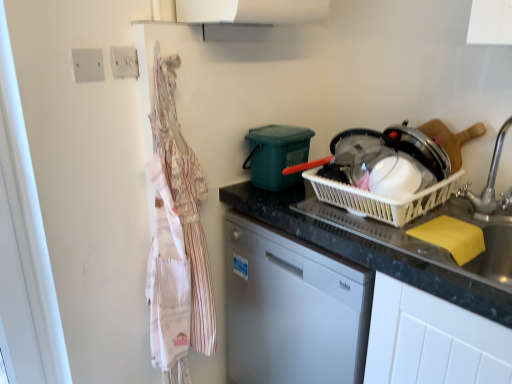
Question: From a real-world perspective, is black granite countertop at center on top of white plastic electric outlet at upper left, which is the second electric outlet from back to front?

Choices:
 (A) no
 (B) yes

Answer: (A)

Question: Considering the relative sizes of black granite countertop at center and white plastic electric outlet at upper left, the 2th electric outlet when ordered from right to left, in the image provided, is black granite countertop at center smaller than white plastic electric outlet at upper left, the 2th electric outlet when ordered from right to left,?

Choices:
 (A) no
 (B) yes

Answer: (A)

Question: From the image's perspective, is black granite countertop at center on top of white plastic electric outlet at upper left, which is counted as the first electric outlet, starting from the left?

Choices:
 (A) no
 (B) yes

Answer: (A)

Question: Could you tell me if black granite countertop at center is facing white plastic electric outlet at upper left, the 2th electric outlet when ordered from right to left?

Choices:
 (A) yes
 (B) no

Answer: (B)

Question: Does black granite countertop at center lie in front of white plastic electric outlet at upper left, the 2th electric outlet when ordered from right to left?

Choices:
 (A) yes
 (B) no

Answer: (A)

Question: Is black granite countertop at center to the left of white plastic electric outlet at upper left, which is counted as the first electric outlet, starting from the left, from the viewer's perspective?

Choices:
 (A) yes
 (B) no

Answer: (B)

Question: From a real-world perspective, does white plastic electric outlet at upper left, which is the second electric outlet from back to front, sit lower than white plastic basket at center?

Choices:
 (A) no
 (B) yes

Answer: (A)

Question: Is white plastic electric outlet at upper left, the 1th electric outlet from the front, facing away from white plastic basket at center?

Choices:
 (A) no
 (B) yes

Answer: (A)

Question: Is white plastic electric outlet at upper left, the 1th electric outlet from the front, positioned before white plastic basket at center?

Choices:
 (A) yes
 (B) no

Answer: (B)

Question: From a real-world perspective, is white plastic electric outlet at upper left, the 1th electric outlet from the front, located higher than white plastic basket at center?

Choices:
 (A) yes
 (B) no

Answer: (A)

Question: Is white plastic electric outlet at upper left, which is the second electric outlet from back to front, smaller than white plastic basket at center?

Choices:
 (A) no
 (B) yes

Answer: (B)

Question: Is white plastic basket at center located within white plastic electric outlet at upper left, the 2th electric outlet when ordered from right to left?

Choices:
 (A) no
 (B) yes

Answer: (A)

Question: Is white plastic electric outlet at upper left, arranged as the 1th electric outlet when viewed from the right, aimed at yellow sponge at sink?

Choices:
 (A) yes
 (B) no

Answer: (B)